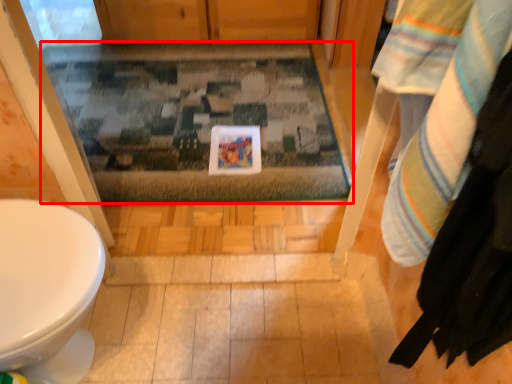
Question: From the image's perspective, considering the relative positions of bath mat (annotated by the red box) and laundry in the image provided, where is bath mat (annotated by the red box) located with respect to the staircase?

Choices:
 (A) above
 (B) below

Answer: (A)